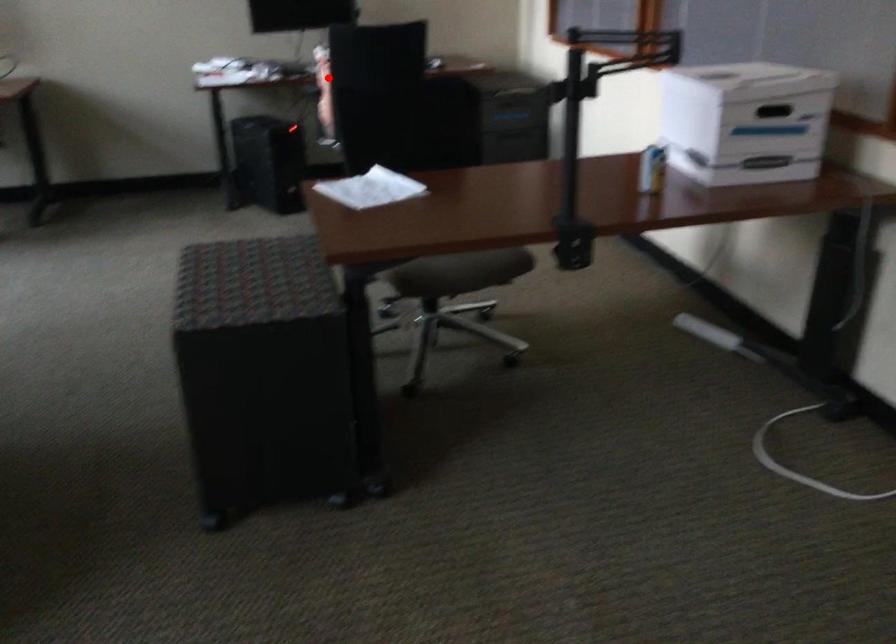
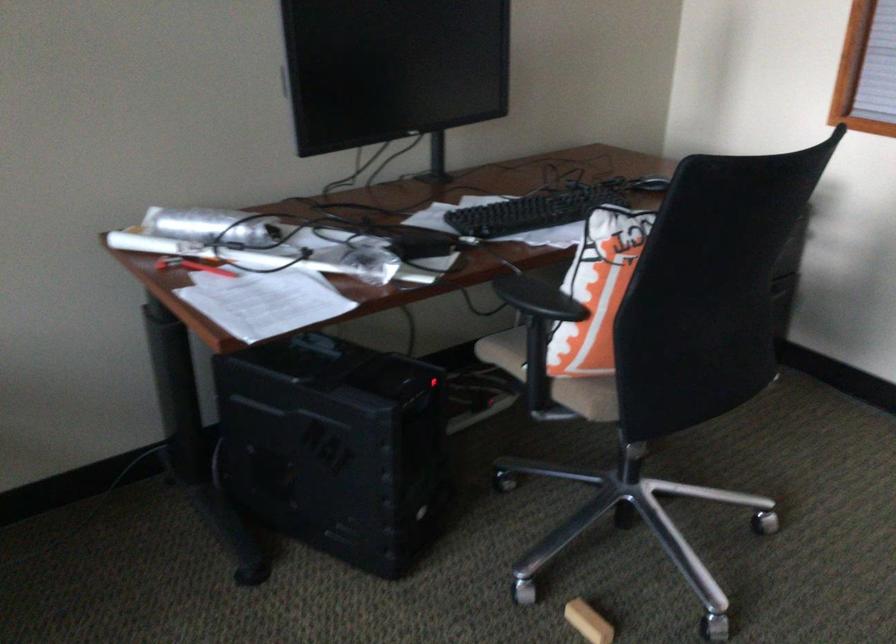
Find the pixel in the second image that matches the highlighted location in the first image.

(538, 299)